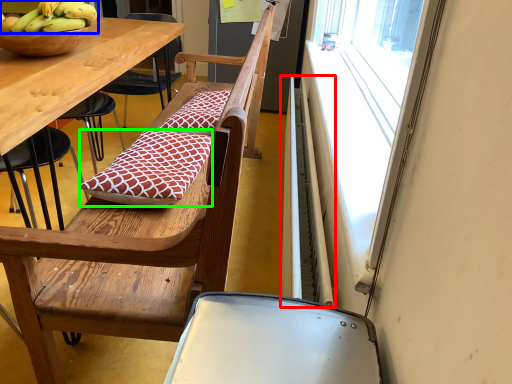
Question: Which object is positioned closest to radiator (highlighted by a red box)? Select from banana (highlighted by a blue box) and pillow (highlighted by a green box).

Choices:
 (A) banana
 (B) pillow

Answer: (B)